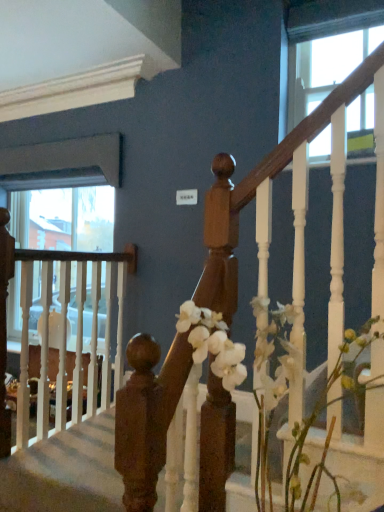
Question: Is wooden handrail at center oriented away from clear glass window at upper right?

Choices:
 (A) yes
 (B) no

Answer: (B)

Question: Is wooden handrail at center thinner than clear glass window at upper right?

Choices:
 (A) no
 (B) yes

Answer: (A)

Question: Is wooden handrail at center wider than clear glass window at upper right?

Choices:
 (A) no
 (B) yes

Answer: (B)

Question: Is wooden handrail at center further to the viewer compared to clear glass window at upper right?

Choices:
 (A) no
 (B) yes

Answer: (A)

Question: Does wooden handrail at center appear on the right side of clear glass window at upper right?

Choices:
 (A) no
 (B) yes

Answer: (A)

Question: From the image's perspective, is wooden handrail at center on clear glass window at upper right?

Choices:
 (A) yes
 (B) no

Answer: (B)

Question: Considering the relative positions of wooden handrail at center and white matte flowers at center in the image provided, is wooden handrail at center behind white matte flowers at center?

Choices:
 (A) no
 (B) yes

Answer: (B)

Question: Is wooden handrail at center shorter than white matte flowers at center?

Choices:
 (A) no
 (B) yes

Answer: (B)

Question: Would you say wooden handrail at center is outside white matte flowers at center?

Choices:
 (A) yes
 (B) no

Answer: (A)

Question: From a real-world perspective, is wooden handrail at center physically below white matte flowers at center?

Choices:
 (A) no
 (B) yes

Answer: (B)

Question: From the image's perspective, is wooden handrail at center on top of white matte flowers at center?

Choices:
 (A) no
 (B) yes

Answer: (A)

Question: Is wooden handrail at center far from white matte flowers at center?

Choices:
 (A) yes
 (B) no

Answer: (B)

Question: Is clear glass window at upper right far away from wooden handrail at center?

Choices:
 (A) no
 (B) yes

Answer: (B)